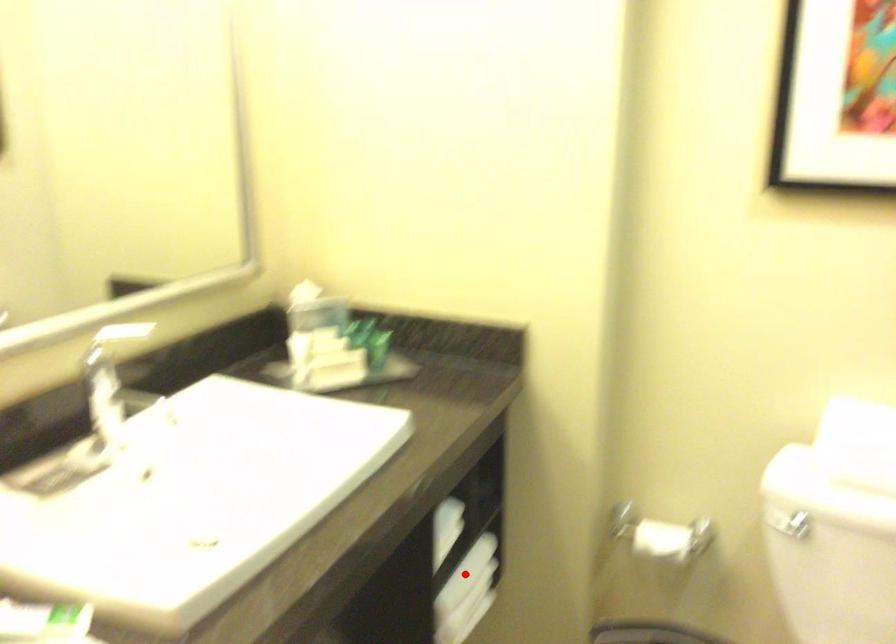
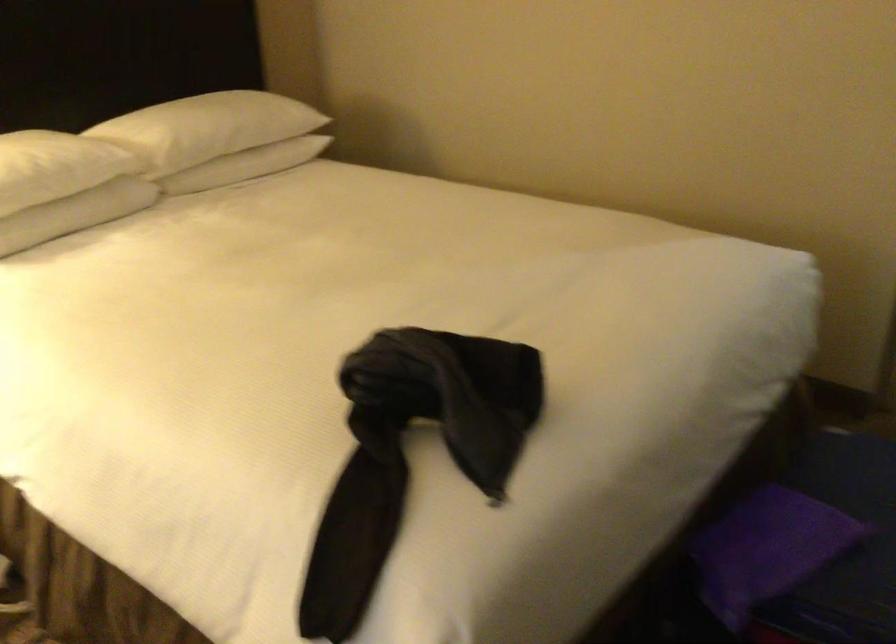
Question: I am providing you with two images of the same scene from different viewpoints. A red point is marked on the first image. At the location where the point appears in image 1, is it still visible in image 2?

Choices:
 (A) Yes
 (B) No

Answer: (B)